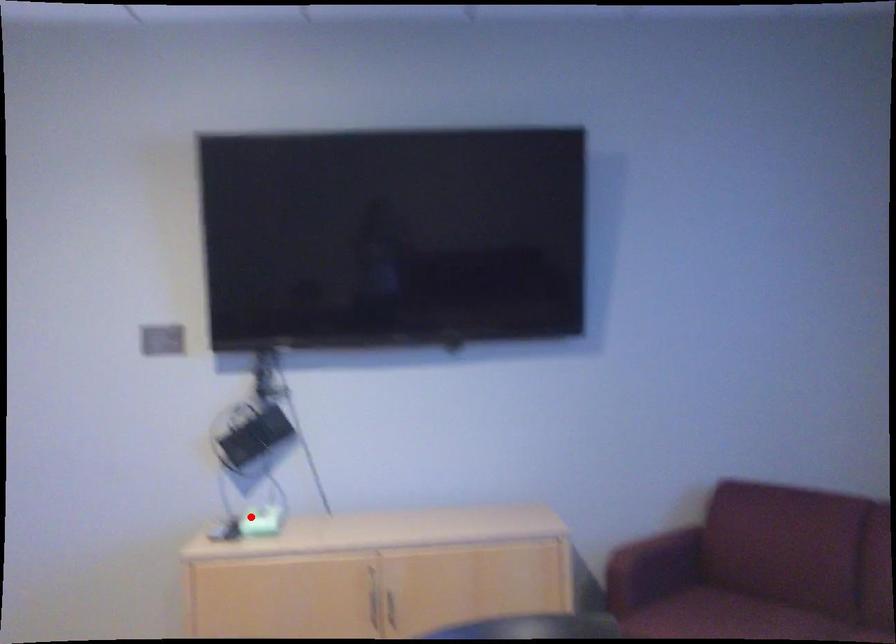
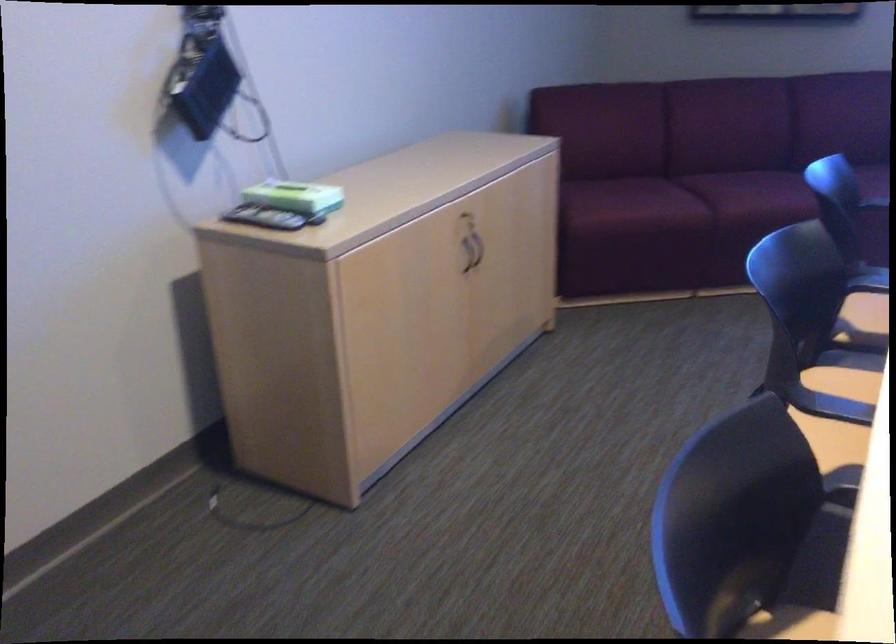
Question: A red point is marked in image1. In image2, is the corresponding 3D point closer to the camera or farther? Reply with the corresponding letter.

Choices:
 (A) The corresponding 3D point is closer.
 (B) The corresponding 3D point is farther.

Answer: (A)